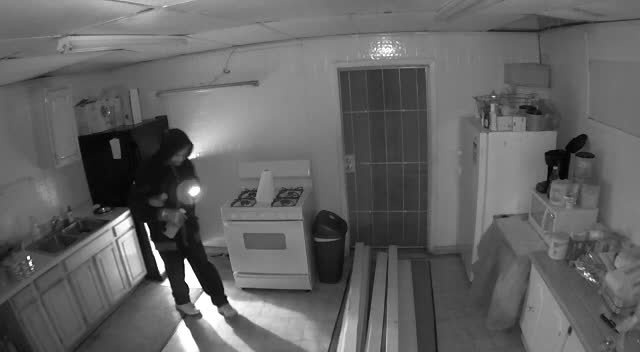
What are the coordinates of `paper towel` in the screenshot? It's located at (264, 184).